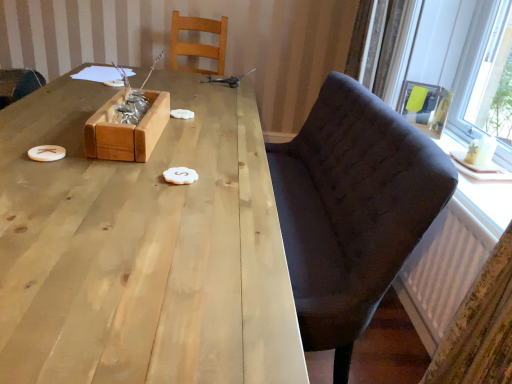
Image resolution: width=512 pixels, height=384 pixels. I want to click on vacant space behind white matte cookie at center, which is counted as the 2th food, starting from the back, so click(195, 160).